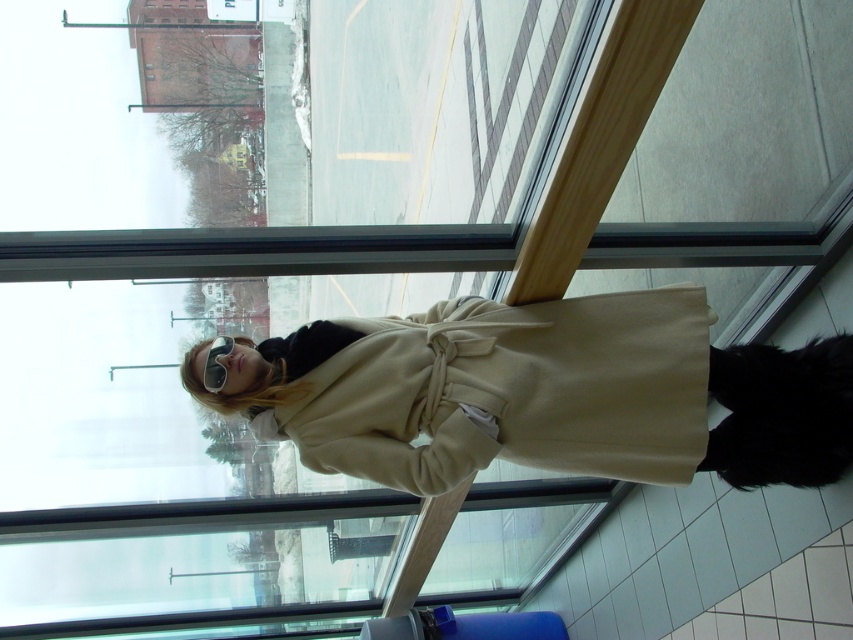
Question: Among these points, which one is farthest from the camera?

Choices:
 (A) (218, 342)
 (B) (561, 372)

Answer: (B)

Question: Which point is closer to the camera?

Choices:
 (A) beige wool coat at center
 (B) matte black goggles at center

Answer: (A)

Question: Does beige wool coat at center appear over matte black goggles at center?

Choices:
 (A) yes
 (B) no

Answer: (B)

Question: Does beige wool coat at center have a greater width compared to matte black goggles at center?

Choices:
 (A) no
 (B) yes

Answer: (B)

Question: Which object appears farthest from the camera in this image?

Choices:
 (A) matte black goggles at center
 (B) beige wool coat at center

Answer: (A)

Question: Observing the image, what is the correct spatial positioning of beige wool coat at center in reference to matte black goggles at center?

Choices:
 (A) left
 (B) right

Answer: (B)